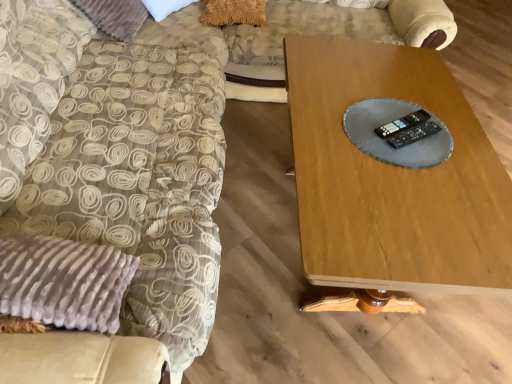
Find the location of a particular element. blank space to the left of black plastic remote at center, which appears as the second control when ordered from the bottom is located at coordinates (353, 119).